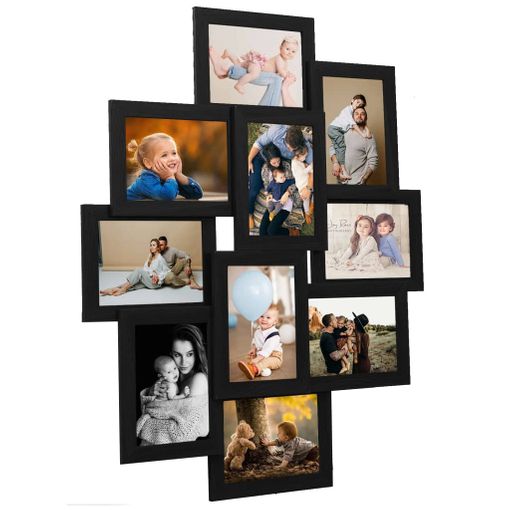
The image size is (510, 510). In order to click on photographs in picture frame in this screenshot , I will do `click(167, 380)`, `click(153, 263)`, `click(169, 163)`, `click(251, 66)`, `click(277, 188)`, `click(261, 331)`, `click(272, 445)`, `click(352, 332)`, `click(363, 234)`, `click(345, 126)`.